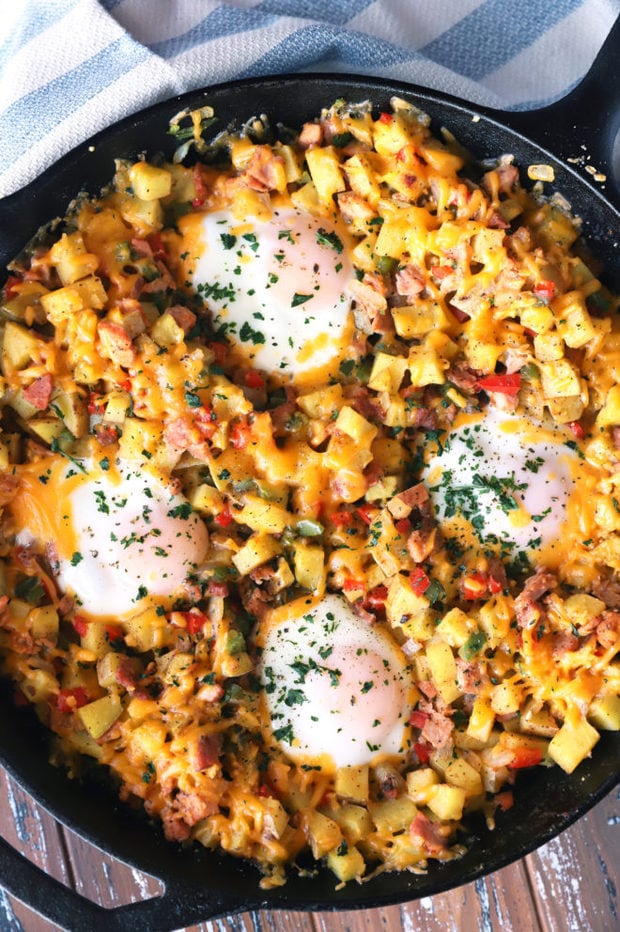
Find the location of a particular element. Image resolution: width=620 pixels, height=932 pixels. left handle is located at coordinates (64, 899).